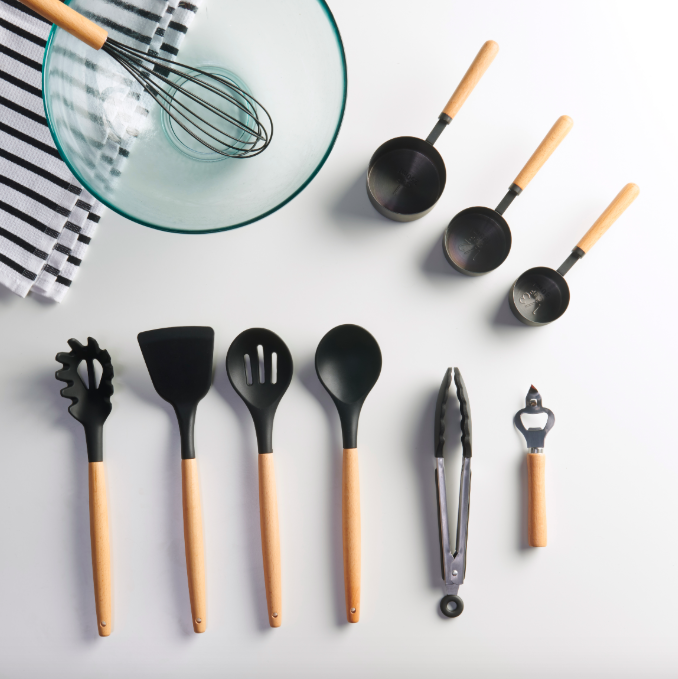
Locate an element on the screen. striped towel is located at coordinates (20, 174).